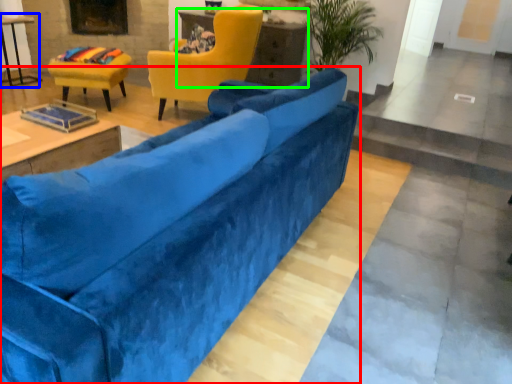
Question: Which is nearer to the studio couch (highlighted by a red box)? table (highlighted by a blue box) or table (highlighted by a green box).

Choices:
 (A) table
 (B) table

Answer: (B)